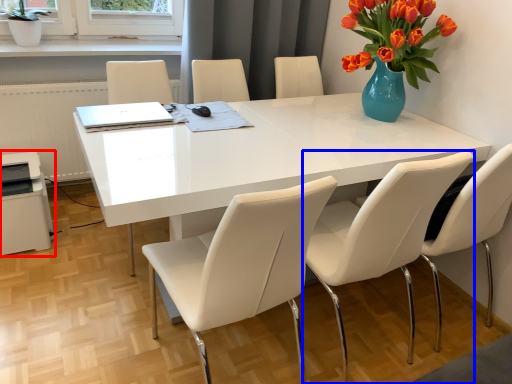
Question: Which of the following is the farthest to the observer, printer (highlighted by a red box) or chair (highlighted by a blue box)?

Choices:
 (A) printer
 (B) chair

Answer: (A)